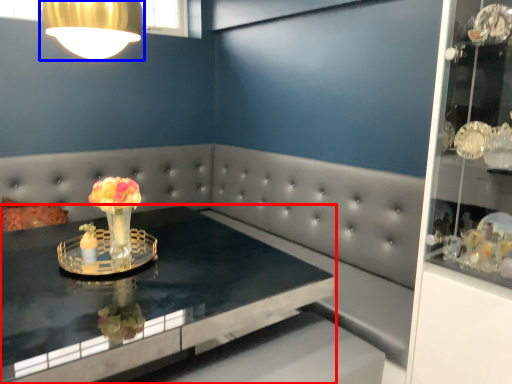
Question: Which object is further to the camera taking this photo, table (highlighted by a red box) or lamp (highlighted by a blue box)?

Choices:
 (A) table
 (B) lamp

Answer: (B)